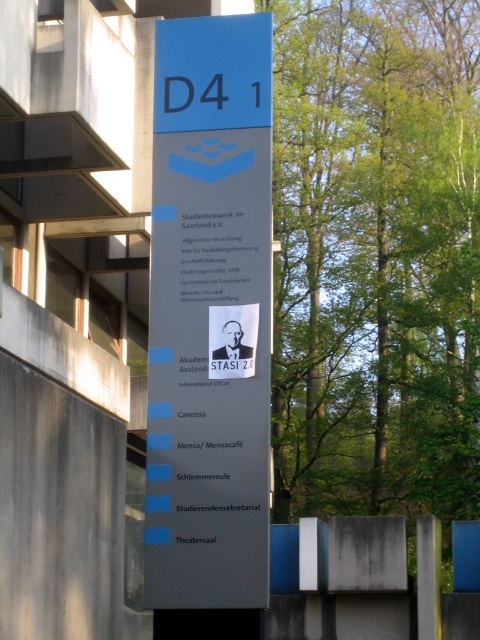
Between blue plastic sign at center and black paper at center, which one appears on the right side from the viewer's perspective?

black paper at center is more to the right.

What do you see at coordinates (210, 316) in the screenshot? This screenshot has height=640, width=480. I see `blue plastic sign at center` at bounding box center [210, 316].

Identify the location of blue plastic sign at center. (210, 316).